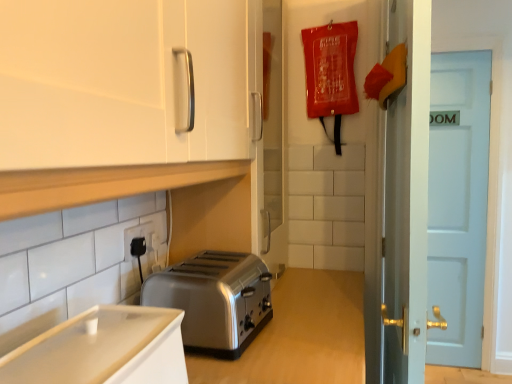
Where is `free region under white wooden door at right (from a real-world perspective)`? Image resolution: width=512 pixels, height=384 pixels. free region under white wooden door at right (from a real-world perspective) is located at coordinates (457, 362).